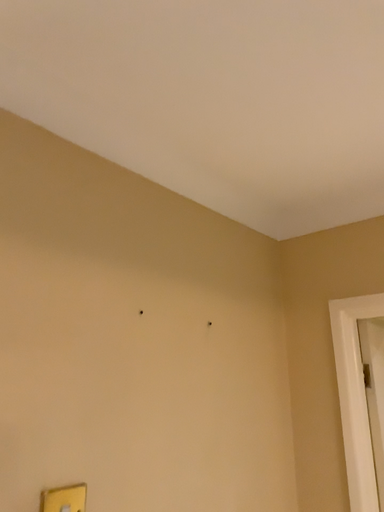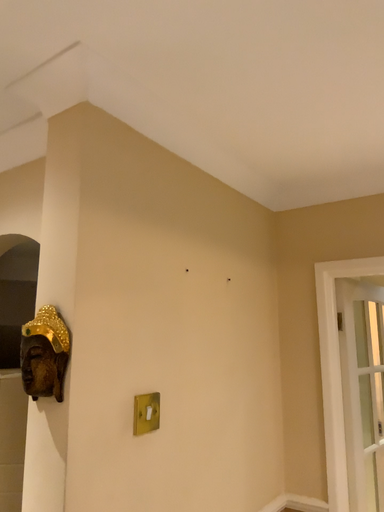
Question: How did the camera likely rotate when shooting the video?

Choices:
 (A) rotated upward
 (B) rotated downward

Answer: (B)